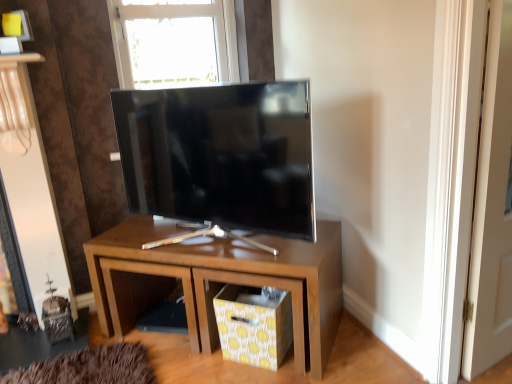
Question: Considering the relative sizes of matte wood nightstand at center and yellow dotted fabric drawer at lower center in the image provided, is matte wood nightstand at center smaller than yellow dotted fabric drawer at lower center?

Choices:
 (A) yes
 (B) no

Answer: (B)

Question: Does matte wood nightstand at center appear on the right side of yellow dotted fabric drawer at lower center?

Choices:
 (A) yes
 (B) no

Answer: (B)

Question: Is matte wood nightstand at center aimed at yellow dotted fabric drawer at lower center?

Choices:
 (A) yes
 (B) no

Answer: (A)

Question: Is matte wood nightstand at center at the left side of yellow dotted fabric drawer at lower center?

Choices:
 (A) yes
 (B) no

Answer: (A)

Question: Does matte wood nightstand at center touch yellow dotted fabric drawer at lower center?

Choices:
 (A) yes
 (B) no

Answer: (B)

Question: From the image's perspective, is transparent glass window at upper center located above or below matte wood nightstand at center?

Choices:
 (A) above
 (B) below

Answer: (A)

Question: Do you think transparent glass window at upper center is within matte wood nightstand at center, or outside of it?

Choices:
 (A) inside
 (B) outside

Answer: (B)

Question: Considering the positions of point (230, 49) and point (312, 294), is point (230, 49) closer or farther from the camera than point (312, 294)?

Choices:
 (A) farther
 (B) closer

Answer: (A)

Question: Is transparent glass window at upper center to the left or to the right of matte wood nightstand at center in the image?

Choices:
 (A) left
 (B) right

Answer: (A)

Question: Is matte black tv at center spatially inside matte wood nightstand at center, or outside of it?

Choices:
 (A) inside
 (B) outside

Answer: (B)

Question: Considering their positions, is matte black tv at center located in front of or behind matte wood nightstand at center?

Choices:
 (A) behind
 (B) front

Answer: (B)

Question: In terms of width, does matte black tv at center look wider or thinner when compared to matte wood nightstand at center?

Choices:
 (A) thin
 (B) wide

Answer: (A)

Question: Is point pyautogui.click(x=273, y=170) positioned closer to the camera than point pyautogui.click(x=189, y=316)?

Choices:
 (A) farther
 (B) closer

Answer: (B)

Question: Considering their positions, is yellow dotted fabric drawer at lower center located in front of or behind matte black tv at center?

Choices:
 (A) behind
 (B) front

Answer: (A)

Question: Is point (227, 336) positioned closer to the camera than point (208, 94)?

Choices:
 (A) farther
 (B) closer

Answer: (A)